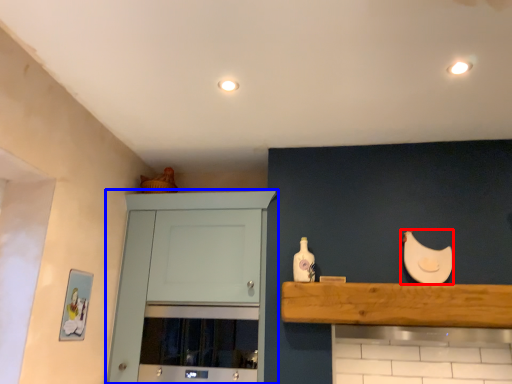
Question: Which object is further to the camera taking this photo, chicken (highlighted by a red box) or cabinetry (highlighted by a blue box)?

Choices:
 (A) chicken
 (B) cabinetry

Answer: (A)